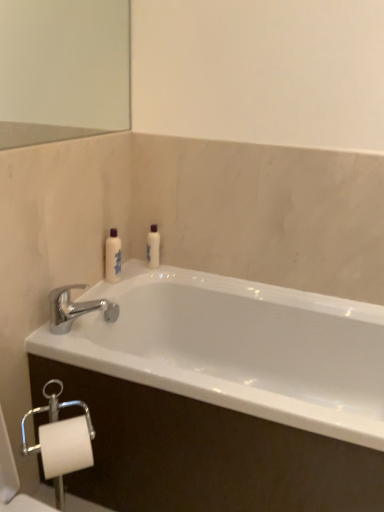
The image size is (384, 512). What are the coordinates of `vacant space that is in between white glossy bottle at upper left, which is counted as the first toiletry, starting from the front, and white glossy lotion at center, the 1th toiletry viewed from the right` in the screenshot? It's located at (143, 268).